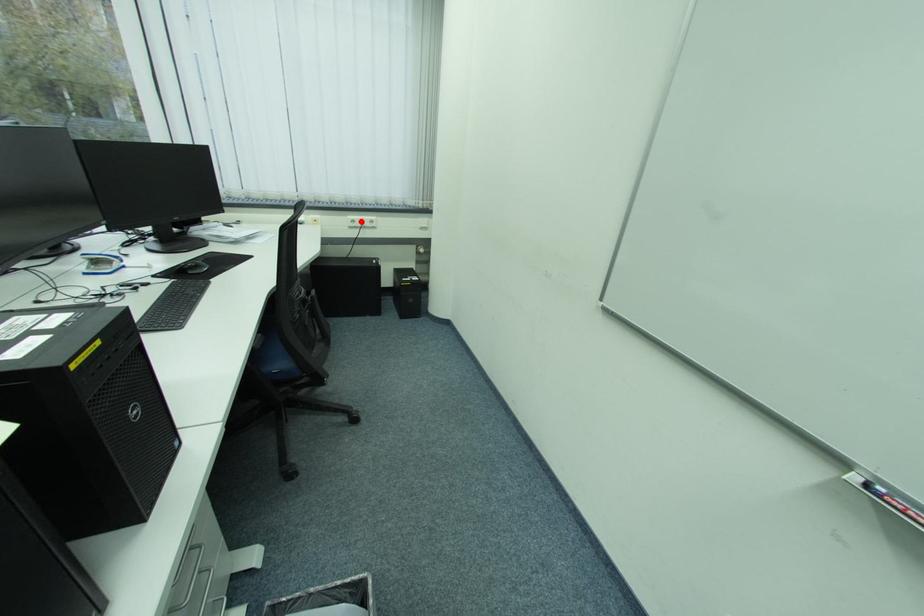
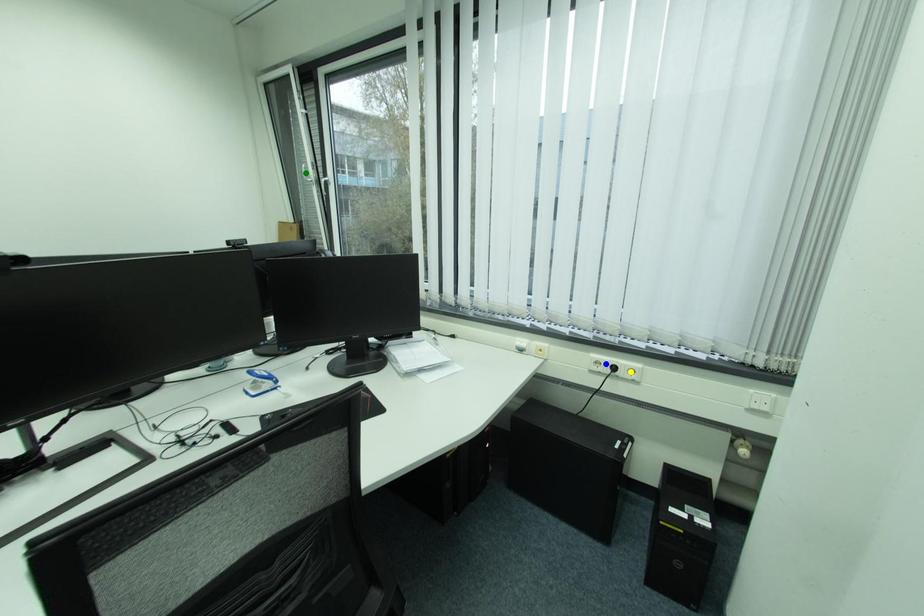
Question: I am providing you with two images of the same scene from different viewpoints. A red point is marked on the first image. You are given multiple points on the second image. In image 2, which mark is for the same physical point as the one in image 1?

Choices:
 (A) green point
 (B) blue point
 (C) yellow point

Answer: (B)